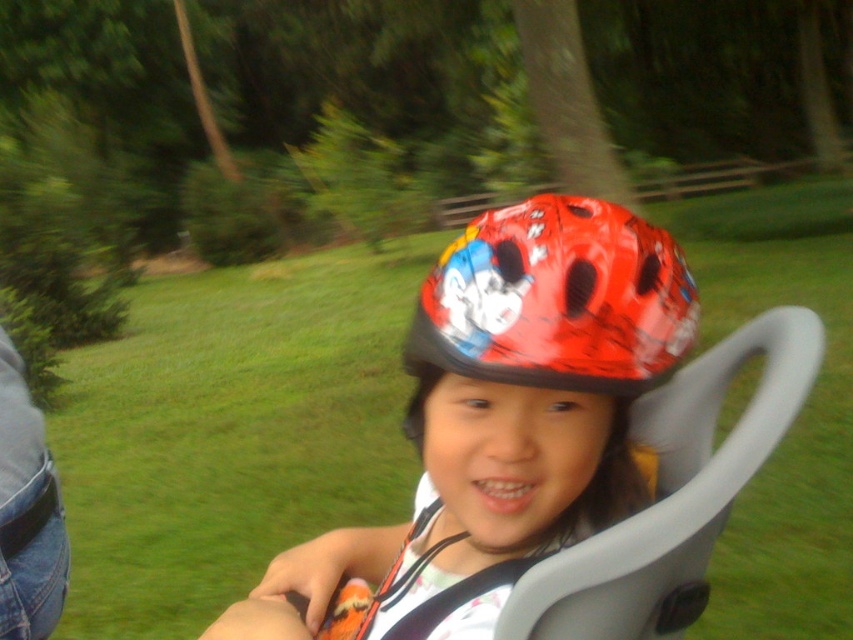
You are a photographer trying to capture a clear photo of the child wearing both the glossy plastic helmet at center and the shiny red helmet at center. Which helmet should you focus on first to ensure it appears sharp in the photo?

The glossy plastic helmet at center is closer to the viewer than the shiny red helmet at center, so you should focus on the glossy plastic helmet at center first to ensure it appears sharp.